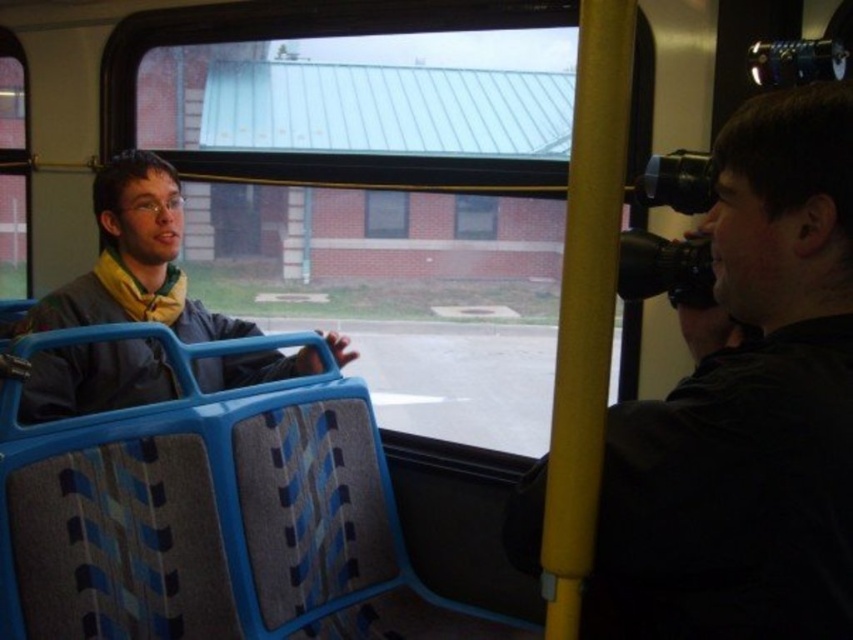
Question: Does black rubber camera at right appear on the right side of matte gray jacket at left?

Choices:
 (A) yes
 (B) no

Answer: (A)

Question: Which of the following is the closest to the observer?

Choices:
 (A) (234, 321)
 (B) (722, 230)

Answer: (B)

Question: Is black rubber camera at right wider than matte gray jacket at left?

Choices:
 (A) no
 (B) yes

Answer: (A)

Question: Can you confirm if black rubber camera at right is positioned above matte gray jacket at left?

Choices:
 (A) yes
 (B) no

Answer: (A)